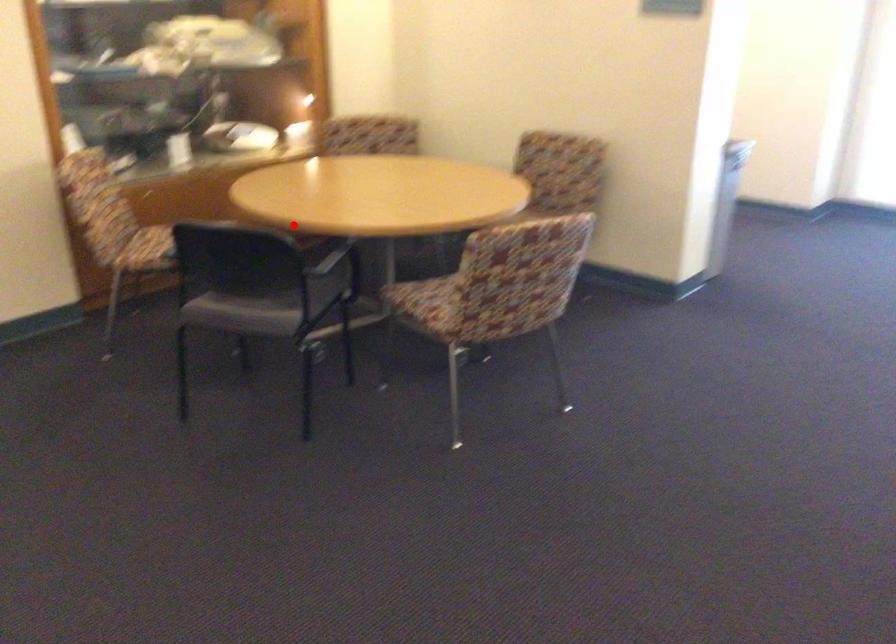
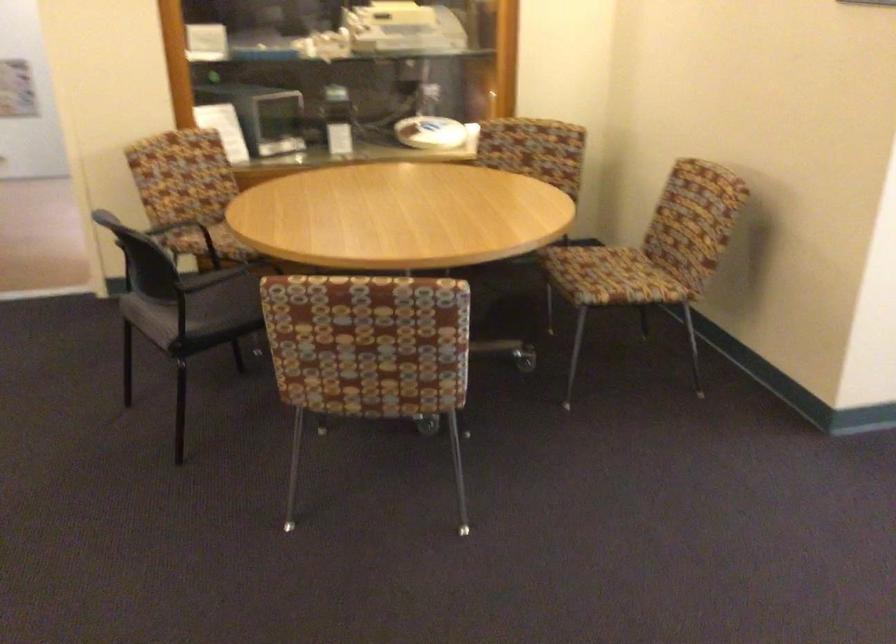
The point at the highlighted location is marked in the first image. Where is the corresponding point in the second image?

(228, 229)